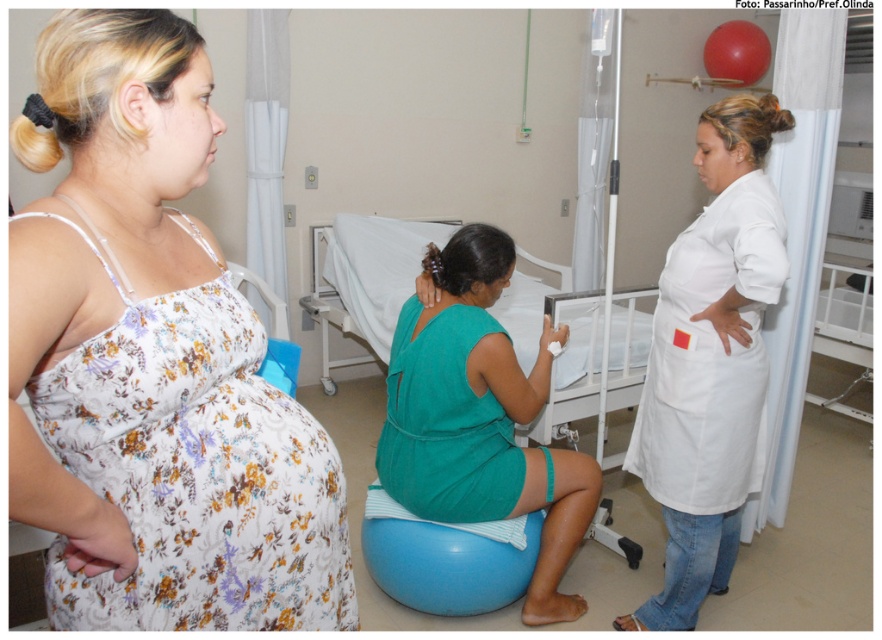
Does point (178, 563) come in front of point (674, 349)?

Yes, it is in front of point (674, 349).

Is floral fabric dress at center positioned at the back of white smooth lab coat at center?

No, it is in front of white smooth lab coat at center.

Find the location of `floral fabric dress at center`. floral fabric dress at center is located at coordinates (153, 364).

Who is positioned more to the right, white smooth lab coat at center or white fabric hospital bed at center?

From the viewer's perspective, white smooth lab coat at center appears more on the right side.

Who is positioned more to the left, white smooth lab coat at center or white fabric hospital bed at center?

Positioned to the left is white fabric hospital bed at center.

Find the location of a particular element. The height and width of the screenshot is (640, 882). white smooth lab coat at center is located at coordinates tap(709, 360).

Can you confirm if floral fabric dress at center is taller than white fabric hospital bed at center?

No, floral fabric dress at center is not taller than white fabric hospital bed at center.

Between floral fabric dress at center and white fabric hospital bed at center, which one has more height?

white fabric hospital bed at center is taller.

Is point (96, 204) more distant than point (594, 330)?

That is False.

Find the location of `floral fabric dress at center`. floral fabric dress at center is located at coordinates (153, 364).